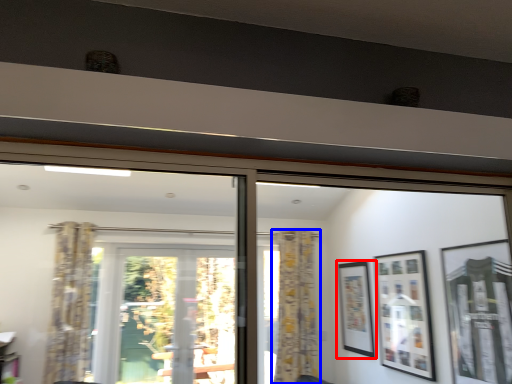
Question: Among these objects, which one is nearest to the camera, picture frame (highlighted by a red box) or curtain (highlighted by a blue box)?

Choices:
 (A) picture frame
 (B) curtain

Answer: (A)